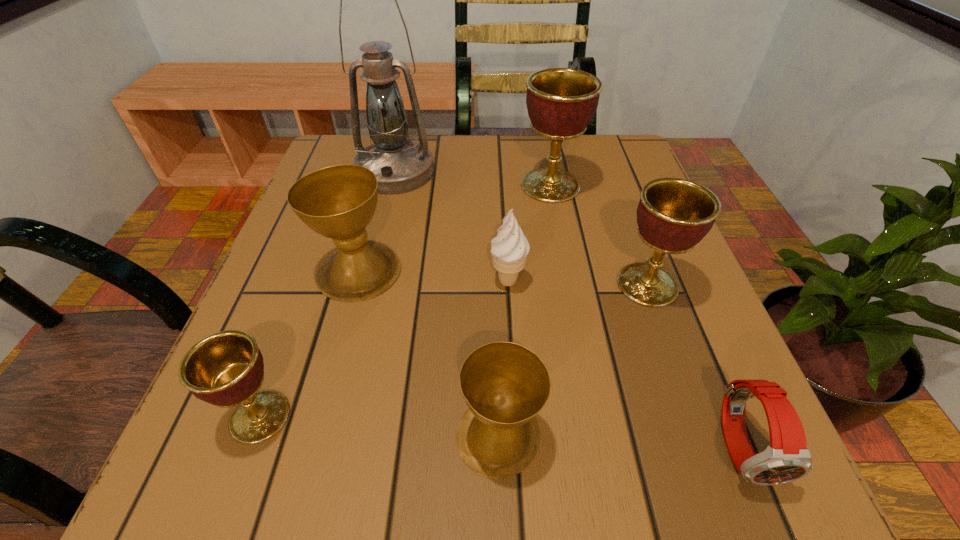
You are a GUI agent. You are given a task and a screenshot of the screen. Output one action in this format:
    pyautogui.click(x=<x>, y=<y>)
    Task: Click on the tallest object
    The height and width of the screenshot is (540, 960).
    Given the screenshot: What is the action you would take?
    tap(400, 165)

The image size is (960, 540). Find the location of `the farthest golden chalice`. the farthest golden chalice is located at coordinates (561, 102).

Locate an element on the screen. The width and height of the screenshot is (960, 540). the second tallest object is located at coordinates (561, 102).

Locate an element on the screen. The width and height of the screenshot is (960, 540). the bigger brown chalice is located at coordinates (338, 202).

Find the location of a particular element. the farther brown chalice is located at coordinates point(338,202).

I want to click on the rightmost chalice, so click(673, 215).

You are a GUI agent. You are given a task and a screenshot of the screen. Output one action in this format:
    pyautogui.click(x=<x>, y=<y>)
    Task: Click on the rightmost golden chalice
    
    Given the screenshot: What is the action you would take?
    pyautogui.click(x=673, y=215)

In order to click on icecream in this screenshot , I will do `click(509, 249)`.

Locate an element on the screen. This screenshot has height=540, width=960. the right brown chalice is located at coordinates click(505, 385).

I want to click on the smaller brown chalice, so click(x=505, y=385).